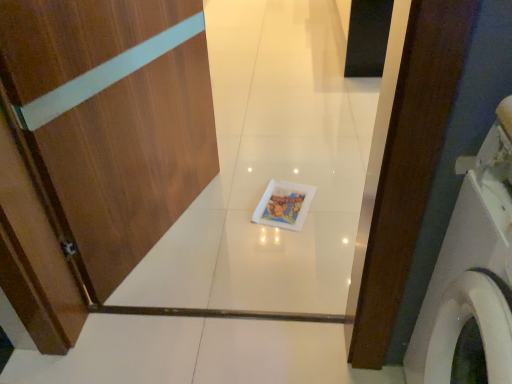
Where is `white glossy washing machine at right`? The height and width of the screenshot is (384, 512). white glossy washing machine at right is located at coordinates (472, 268).

This screenshot has width=512, height=384. Describe the element at coordinates (472, 268) in the screenshot. I see `white glossy washing machine at right` at that location.

This screenshot has width=512, height=384. Describe the element at coordinates (112, 118) in the screenshot. I see `wooden door at center` at that location.

At what (x,y) coordinates should I click in order to perform the action: click on wooden door at center. Please return your answer as a coordinate pair (x, y). This screenshot has width=512, height=384. Looking at the image, I should click on (112, 118).

Image resolution: width=512 pixels, height=384 pixels. In order to click on white glossy washing machine at right in this screenshot , I will do `click(472, 268)`.

Between wooden door at center and white glossy washing machine at right, which one appears on the right side from the viewer's perspective?

white glossy washing machine at right.

Considering the relative positions of wooden door at center and white glossy washing machine at right in the image provided, is wooden door at center behind white glossy washing machine at right?

Yes, it is behind white glossy washing machine at right.

Between point (44, 122) and point (490, 187), which one is positioned in front?

The point (490, 187) is in front.

From the image's perspective, would you say wooden door at center is shown under white glossy washing machine at right?

No, from the image's perspective, wooden door at center is not beneath white glossy washing machine at right.

From a real-world perspective, who is located higher, wooden door at center or white glossy washing machine at right?

wooden door at center.

Between wooden door at center and white glossy washing machine at right, which one has larger width?

With larger width is white glossy washing machine at right.

Does wooden door at center have a lesser height compared to white glossy washing machine at right?

No, wooden door at center is not shorter than white glossy washing machine at right.

Between wooden door at center and white glossy washing machine at right, which one has larger size?

Bigger between the two is white glossy washing machine at right.

Is white glossy washing machine at right completely or partially inside wooden door at center?

No, white glossy washing machine at right is not surrounded by wooden door at center.

Are wooden door at center and white glossy washing machine at right beside each other?

No, wooden door at center is not with white glossy washing machine at right.

Is wooden door at center facing away from white glossy washing machine at right?

wooden door at center does not have its back to white glossy washing machine at right.

The image size is (512, 384). I want to click on washing machine in front of the wooden door at center, so click(x=472, y=268).

Does white glossy washing machine at right appear on the right side of wooden door at center?

Correct, you'll find white glossy washing machine at right to the right of wooden door at center.

Which is behind, white glossy washing machine at right or wooden door at center?

wooden door at center is further away from the camera.

Does point (419, 360) come in front of point (169, 202)?

Yes.

From the image's perspective, between white glossy washing machine at right and wooden door at center, who is located below?

white glossy washing machine at right.

From a real-world perspective, is white glossy washing machine at right positioned under wooden door at center based on gravity?

Yes, from a real-world perspective, white glossy washing machine at right is below wooden door at center.

Can you confirm if white glossy washing machine at right is wider than wooden door at center?

Correct, the width of white glossy washing machine at right exceeds that of wooden door at center.

Consider the image. Between white glossy washing machine at right and wooden door at center, which one has less height?

white glossy washing machine at right is shorter.

In the scene shown: Who is bigger, white glossy washing machine at right or wooden door at center?

white glossy washing machine at right.

Is wooden door at center a part of white glossy washing machine at right?

Definitely not — wooden door at center is not inside white glossy washing machine at right.

Would you consider white glossy washing machine at right to be distant from wooden door at center?

No, white glossy washing machine at right is not far from wooden door at center.

Is white glossy washing machine at right aimed at wooden door at center?

No, white glossy washing machine at right is not facing towards wooden door at center.

How many degrees apart are the facing directions of white glossy washing machine at right and wooden door at center?

They differ by 159 degrees in their facing directions.

Where is `door above the white glossy washing machine at right (from the image's perspective)`? The image size is (512, 384). door above the white glossy washing machine at right (from the image's perspective) is located at coordinates (112, 118).

Find the location of `washing machine below the wooden door at center (from a real-world perspective)`. washing machine below the wooden door at center (from a real-world perspective) is located at coordinates (472, 268).

At what (x,y) coordinates should I click in order to perform the action: click on washing machine to the right of wooden door at center. Please return your answer as a coordinate pair (x, y). Looking at the image, I should click on (472, 268).